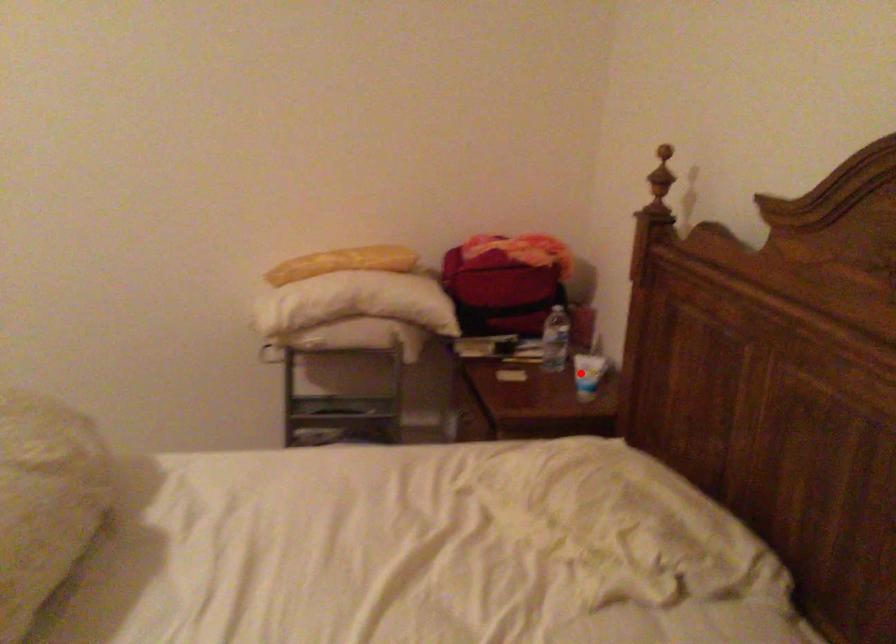
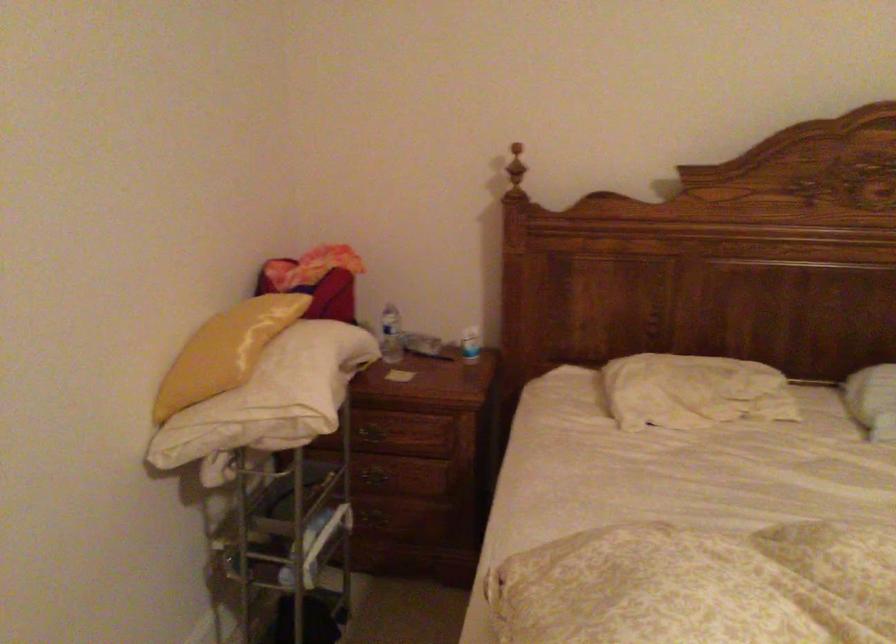
Question: I am providing you with two images of the same scene from different viewpoints. In image1, a red point is highlighted. Considering the same 3D point in image2, which of the following is correct?

Choices:
 (A) It is closer
 (B) It is farther

Answer: (B)